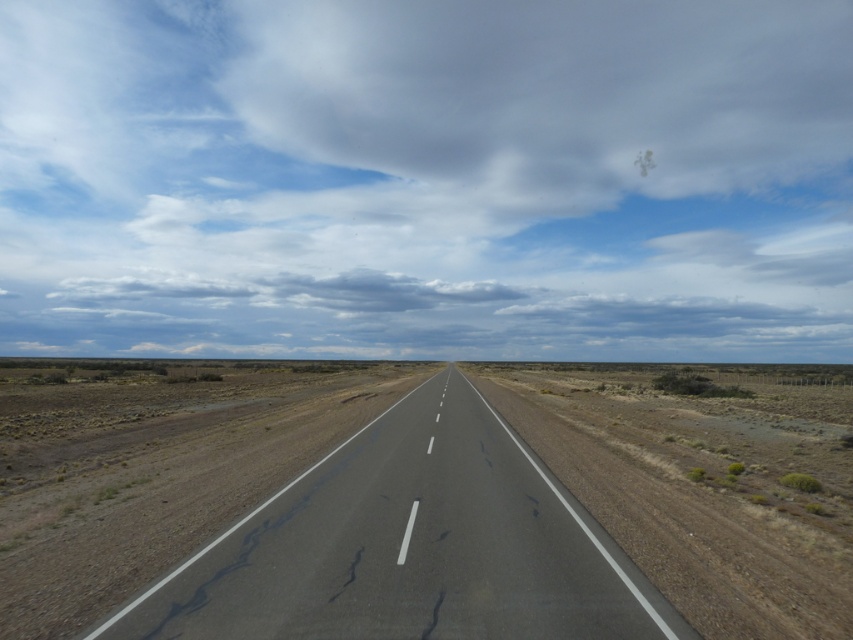
Who is positioned more to the left, white fluffy cloud at upper center or asphalt road at center?

Positioned to the left is white fluffy cloud at upper center.

In the scene shown: Between white fluffy cloud at upper center and asphalt road at center, which one appears on the right side from the viewer's perspective?

asphalt road at center

Describe the element at coordinates (427, 179) in the screenshot. The image size is (853, 640). I see `white fluffy cloud at upper center` at that location.

Locate an element on the screen. white fluffy cloud at upper center is located at coordinates (427, 179).